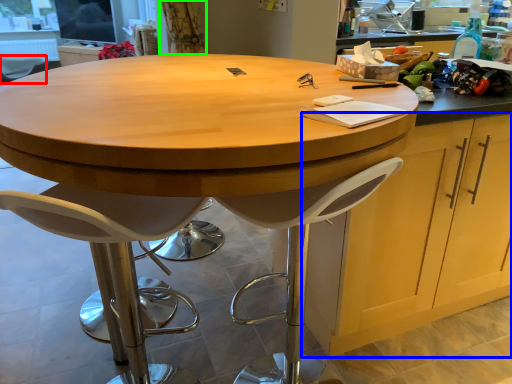
Question: Which object is positioned farthest from chair (highlighted by a red box)? Select from cabinetry (highlighted by a blue box) and curtain (highlighted by a green box).

Choices:
 (A) cabinetry
 (B) curtain

Answer: (A)